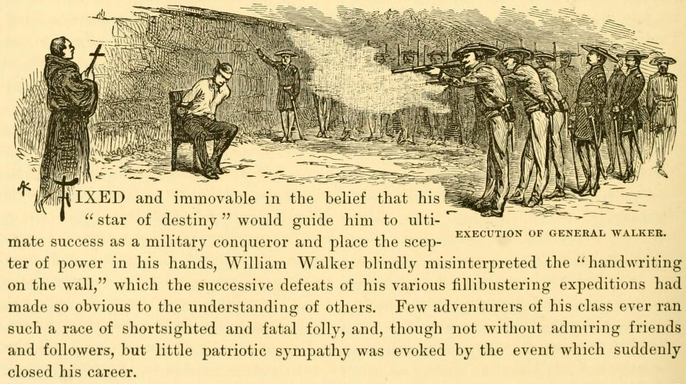
Locate an element on the screen. wall is located at coordinates (173, 40).